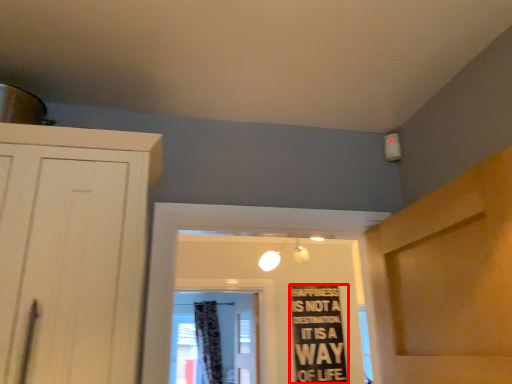
Question: From the image's perspective, considering the relative positions of bulletin board (annotated by the red box) and curtain in the image provided, where is bulletin board (annotated by the red box) located with respect to the staircase?

Choices:
 (A) above
 (B) below

Answer: (A)